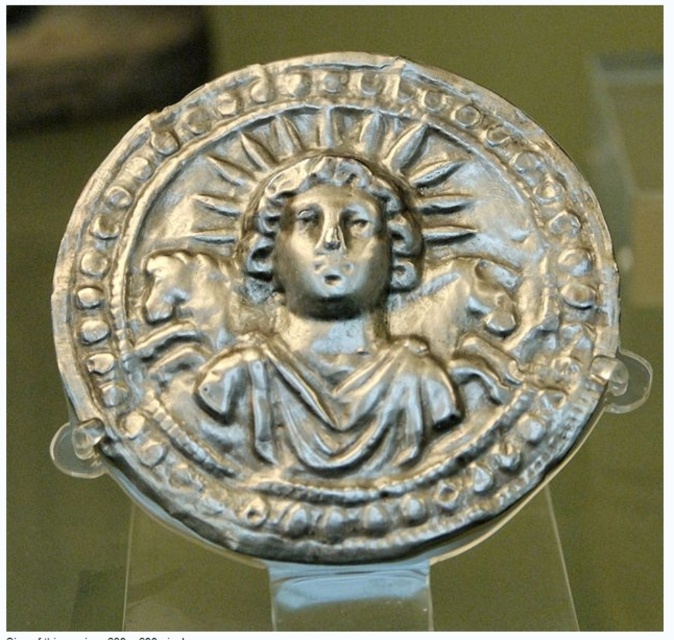
Describe the element at coordinates (332, 321) in the screenshot. I see `shiny silver deity at center` at that location.

Does shiny silver deity at center appear over shiny silver head at center?

No.

What do you see at coordinates (332, 321) in the screenshot? I see `shiny silver deity at center` at bounding box center [332, 321].

Identify the location of shiny silver deity at center. (332, 321).

Is shiny silver coin at center closer to camera compared to shiny silver deity at center?

Yes, it is in front of shiny silver deity at center.

Which is behind, point (88, 456) or point (286, 317)?

The point (286, 317) is more distant.

Where is `shiny silver coin at center`? shiny silver coin at center is located at coordinates (337, 312).

This screenshot has height=640, width=674. What do you see at coordinates (337, 312) in the screenshot?
I see `shiny silver coin at center` at bounding box center [337, 312].

Is point (204, 140) farther from camera compared to point (404, 284)?

Yes.

Does point (266, 440) come closer to viewer compared to point (394, 237)?

Yes, point (266, 440) is in front of point (394, 237).

The width and height of the screenshot is (674, 640). Find the location of `shiny silver coin at center`. shiny silver coin at center is located at coordinates (337, 312).